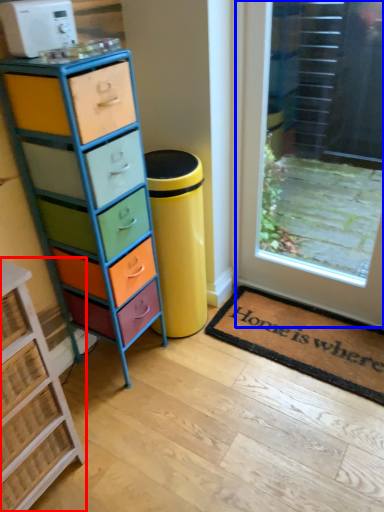
Question: Which point is further to the camera, chest of drawers (highlighted by a red box) or door (highlighted by a blue box)?

Choices:
 (A) chest of drawers
 (B) door

Answer: (B)